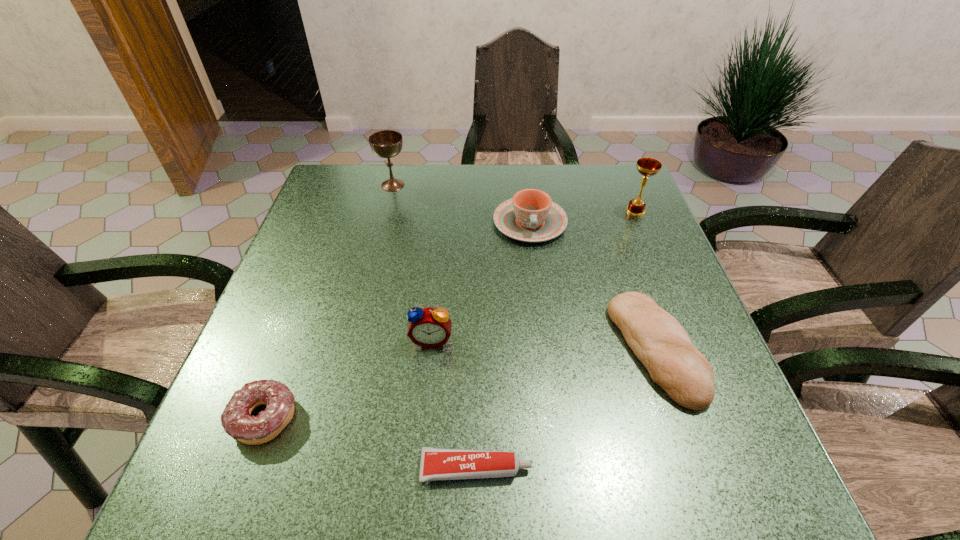
Where is `free point at the near left corner`? The image size is (960, 540). free point at the near left corner is located at coordinates (292, 458).

This screenshot has width=960, height=540. What are the coordinates of `vacant space at the near right corner of the desktop` in the screenshot? It's located at (741, 472).

Identify the location of unoccupied position between the bread and the doughnut. The image size is (960, 540). (460, 383).

This screenshot has width=960, height=540. Identify the location of empty space between the farther chalice and the sixth tallest object. (328, 301).

At what (x,y) coordinates should I click in order to perform the action: click on blank region between the fifth tallest object and the leftmost object. Please return your answer as a coordinate pair (x, y). Looking at the image, I should click on (460, 383).

What are the coordinates of `vacant space in between the nearer chalice and the doughnut` in the screenshot? It's located at (450, 314).

Identify the location of unoccupied area between the fifth shortest object and the chinaware. (481, 281).

This screenshot has width=960, height=540. In order to click on free spot between the bread and the sixth tallest object in this screenshot , I will do `click(460, 383)`.

Identify the location of unoccupied area between the fifth shortest object and the shortest object. (454, 403).

I want to click on empty space between the chinaware and the bread, so click(x=592, y=286).